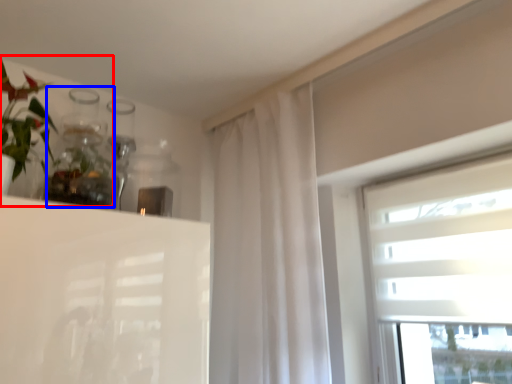
Question: Which object is closer to the camera taking this photo, floral arrangement (highlighted by a red box) or glass vase (highlighted by a blue box)?

Choices:
 (A) floral arrangement
 (B) glass vase

Answer: (A)